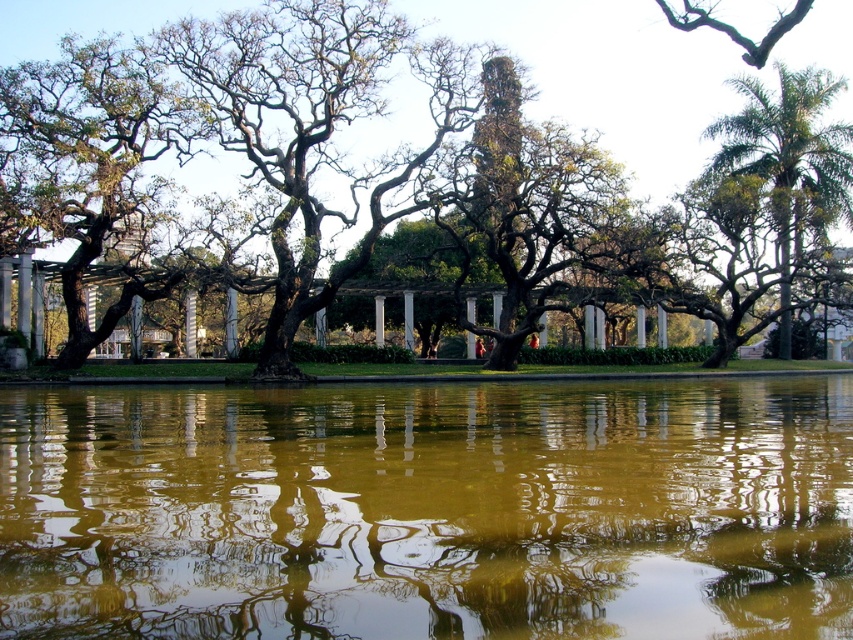
Between point (665, 488) and point (155, 157), which one is positioned in front?

Positioned in front is point (665, 488).

Can you confirm if green reflective water at center is taller than green leafy tree at left?

No, green reflective water at center is not taller than green leafy tree at left.

Is point (144, 416) closer to viewer compared to point (94, 216)?

Yes, it is.

Image resolution: width=853 pixels, height=640 pixels. In order to click on green reflective water at center in this screenshot , I will do `click(428, 509)`.

Locate an element on the screen. The width and height of the screenshot is (853, 640). green leafy tree at left is located at coordinates (93, 164).

Describe the element at coordinates (93, 164) in the screenshot. I see `green leafy tree at left` at that location.

Find the location of `green leafy tree at left`. green leafy tree at left is located at coordinates (93, 164).

Does green leafy tree at center have a greater height compared to green leafy tree at left?

Indeed, green leafy tree at center has a greater height compared to green leafy tree at left.

Identify the location of green leafy tree at center. [x=635, y=72].

Measure the distance between green leafy tree at center and camera.

green leafy tree at center and camera are 34.10 meters apart from each other.

Where is `green leafy tree at center`? The width and height of the screenshot is (853, 640). green leafy tree at center is located at coordinates (635, 72).